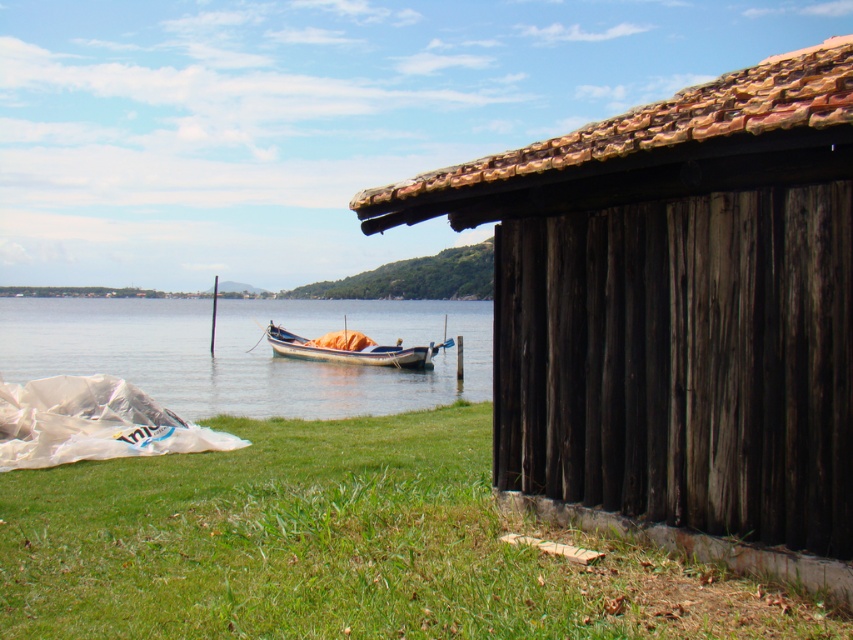
You are a visitor at the lakeside and want to walk from the wooden boat at center to the dark brown wooden hut at right. Which direction should you head towards?

The dark brown wooden hut at right is positioned on the right side of wooden boat at center, so you should head towards the right direction from the wooden boat at center to reach the dark brown wooden hut at right.

You are standing on the wooden boat at center and want to step onto the green grass at lower center. Which direction should you move to reach the grass?

You should move to your right because the green grass at lower center is located to the right of the wooden boat at center.